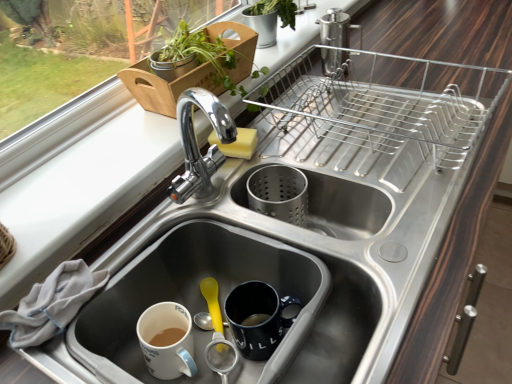
In order to click on free space that is to the left of green leafy plant at upper left, which is counted as the first houseplant, starting from the front in this screenshot , I will do `click(110, 130)`.